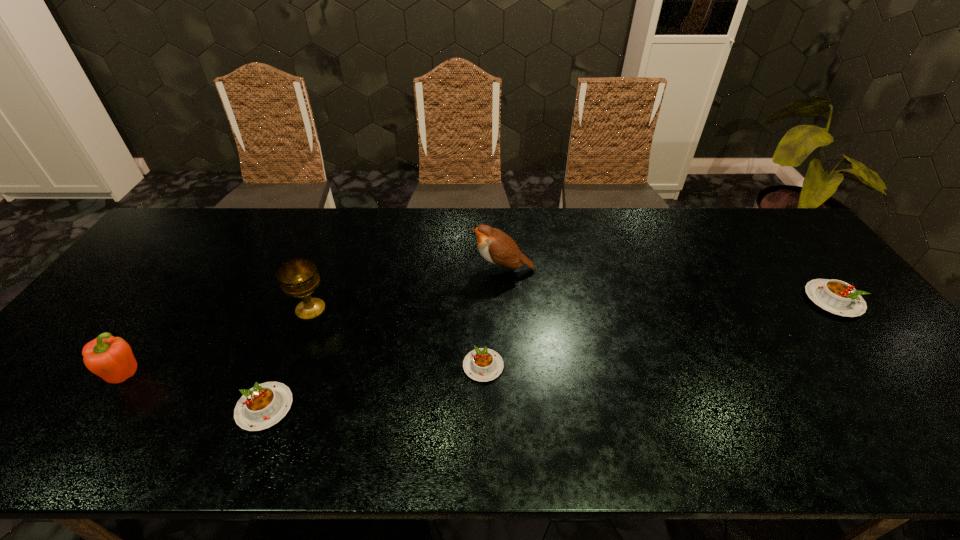
You are a GUI agent. You are given a task and a screenshot of the screen. Output one action in this format:
    pyautogui.click(x=<x>, y=<y>)
    Task: Click on the object positioned at the near left corner
    Image resolution: width=960 pixels, height=540 pixels.
    Given the screenshot: What is the action you would take?
    pyautogui.click(x=111, y=358)

The image size is (960, 540). Identify the location of free space at the far edge of the desktop. (314, 252).

Find the location of `blank space at the near edge of the desktop`. blank space at the near edge of the desktop is located at coordinates (606, 408).

Locate an element on the screen. free region at the left edge of the desktop is located at coordinates (109, 298).

What are the coordinates of `vacant space at the right edge` in the screenshot? It's located at (891, 358).

The height and width of the screenshot is (540, 960). In order to click on free space between the pepper and the bird in this screenshot , I will do `click(314, 323)`.

Find the location of a particular element. This screenshot has width=960, height=540. unoccupied area between the second tallest pudding and the chalice is located at coordinates (288, 359).

Where is `vacant area that lies between the chalice and the bird`? This screenshot has height=540, width=960. vacant area that lies between the chalice and the bird is located at coordinates (407, 289).

Image resolution: width=960 pixels, height=540 pixels. I want to click on vacant region between the bird and the pepper, so click(314, 323).

What are the coordinates of `vacant region between the pepper and the second pudding from right to left` in the screenshot? It's located at (304, 372).